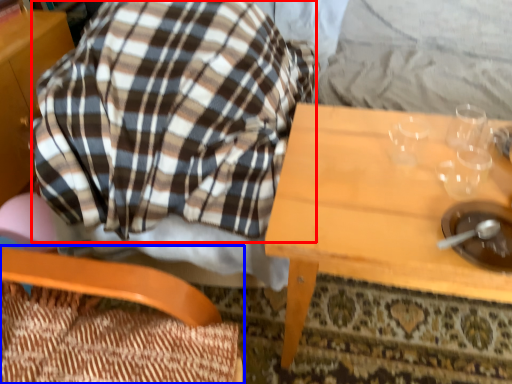
Question: Among these objects, which one is farthest to the camera, flannel (highlighted by a red box) or chair (highlighted by a blue box)?

Choices:
 (A) flannel
 (B) chair

Answer: (A)